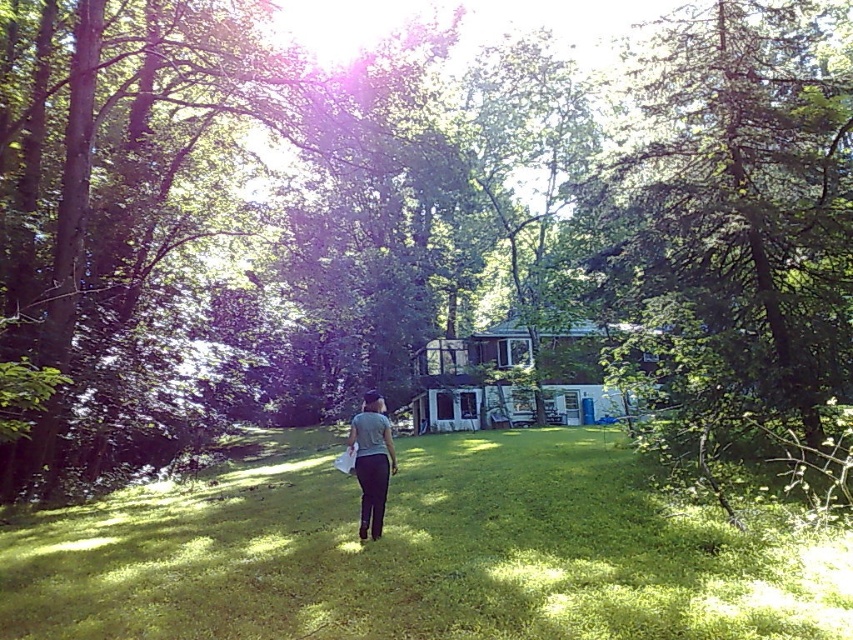
Who is lower down, green grassy lawn at center or gray matte shirt at center?

green grassy lawn at center

Is green grassy lawn at center positioned at the back of gray matte shirt at center?

No, it is in front of gray matte shirt at center.

You are a GUI agent. You are given a task and a screenshot of the screen. Output one action in this format:
    pyautogui.click(x=<x>, y=<y>)
    Task: Click on the green grassy lawn at center
    Image resolution: width=853 pixels, height=640 pixels.
    Given the screenshot: What is the action you would take?
    pyautogui.click(x=418, y=554)

In order to click on green grassy lawn at center in this screenshot , I will do `click(418, 554)`.